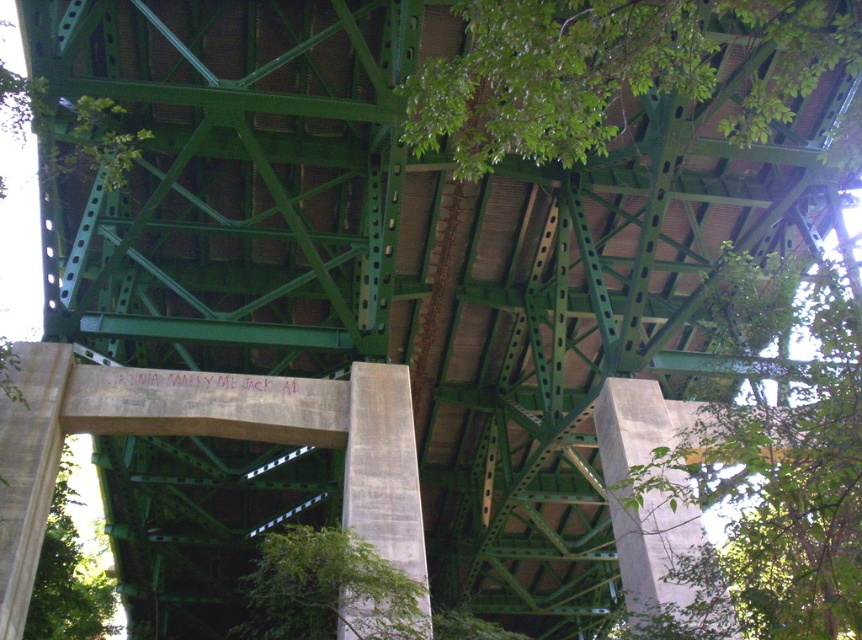
Question: Which of the following is the farthest from the observer?

Choices:
 (A) green leafy tree at center
 (B) green leafy tree at upper right
 (C) green leafy tree at lower center
 (D) green leafy tree at lower left

Answer: (D)

Question: Which point is closer to the camera taking this photo?

Choices:
 (A) (353, 548)
 (B) (554, 4)
 (C) (691, 628)

Answer: (B)

Question: Observing the image, what is the correct spatial positioning of green leafy tree at upper right in reference to green leafy tree at lower center?

Choices:
 (A) right
 (B) left

Answer: (A)

Question: Does green leafy tree at center have a lesser width compared to green leafy tree at lower left?

Choices:
 (A) no
 (B) yes

Answer: (B)

Question: Does green leafy tree at center appear on the left side of green leafy tree at lower center?

Choices:
 (A) yes
 (B) no

Answer: (B)

Question: Which point appears farthest from the camera in this image?

Choices:
 (A) (853, 35)
 (B) (789, 317)

Answer: (A)